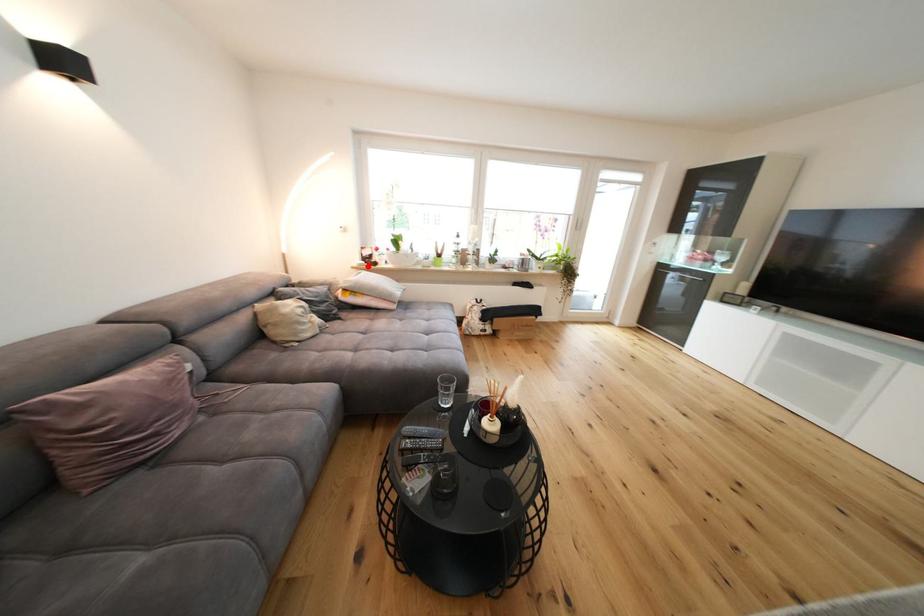
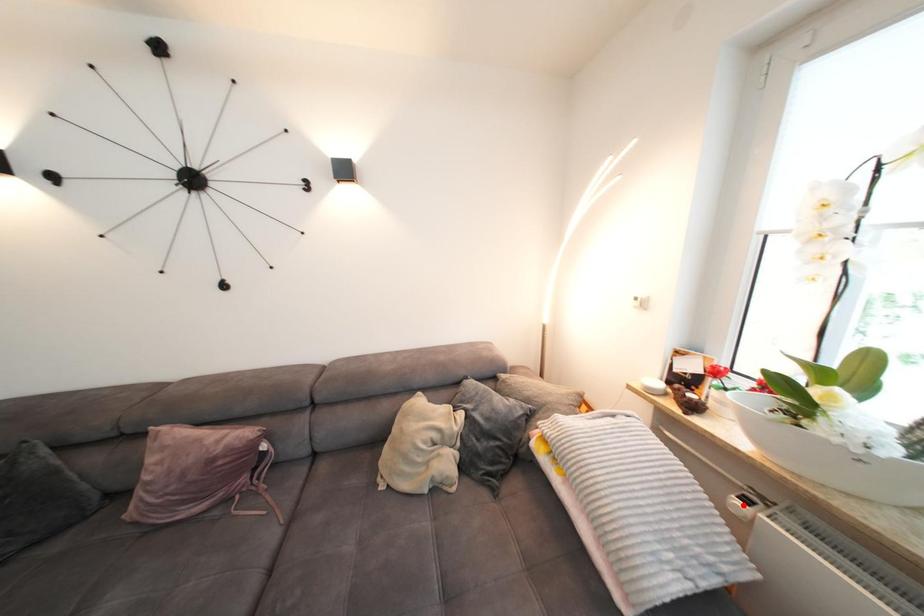
I am providing you with two images of the same scene from different viewpoints. A red point is marked on the first image and another point is marked on the second image. Is the marked point in image1 the same physical position as the marked point in image2?

No